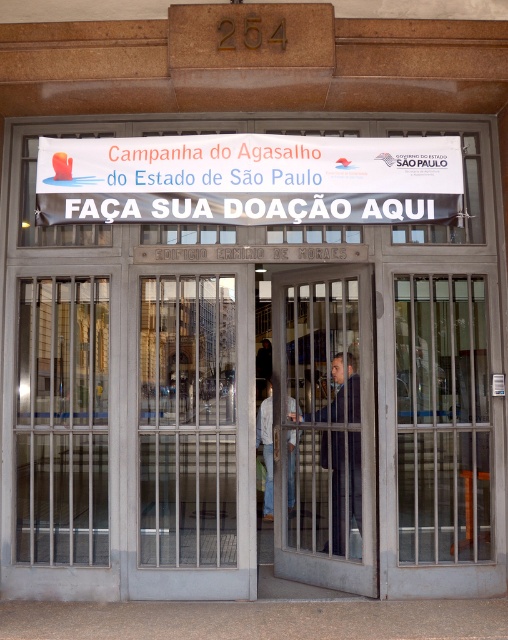
You are a donor wanting to donate clothes. You see the white paper banner at center and the dark blue suit at center. Which object is wider?

The white paper banner at center is wider than the dark blue suit at center.

What is the relationship between the metallic gray door at center and the white paper banner at center in terms of their vertical positioning?

The metallic gray door at center is below the white paper banner at center.